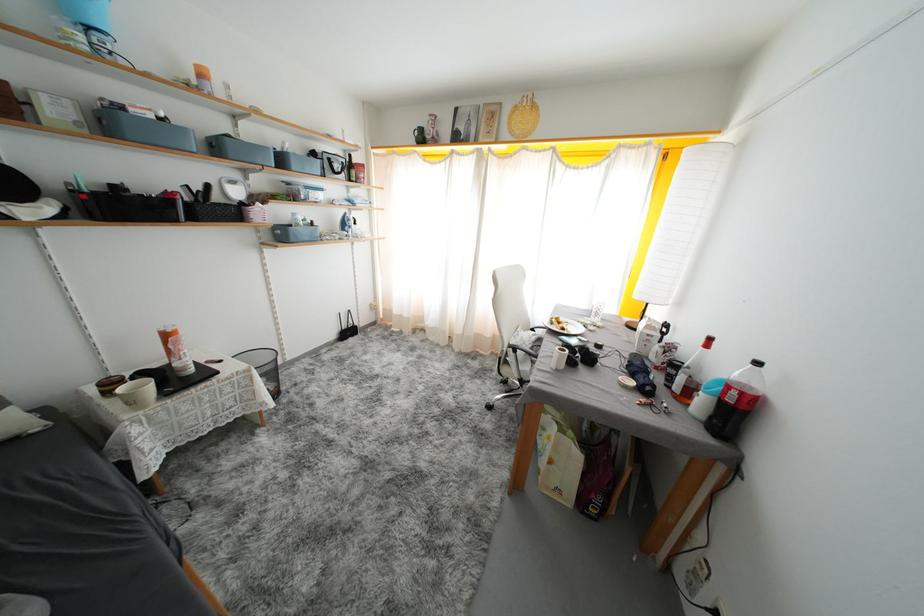
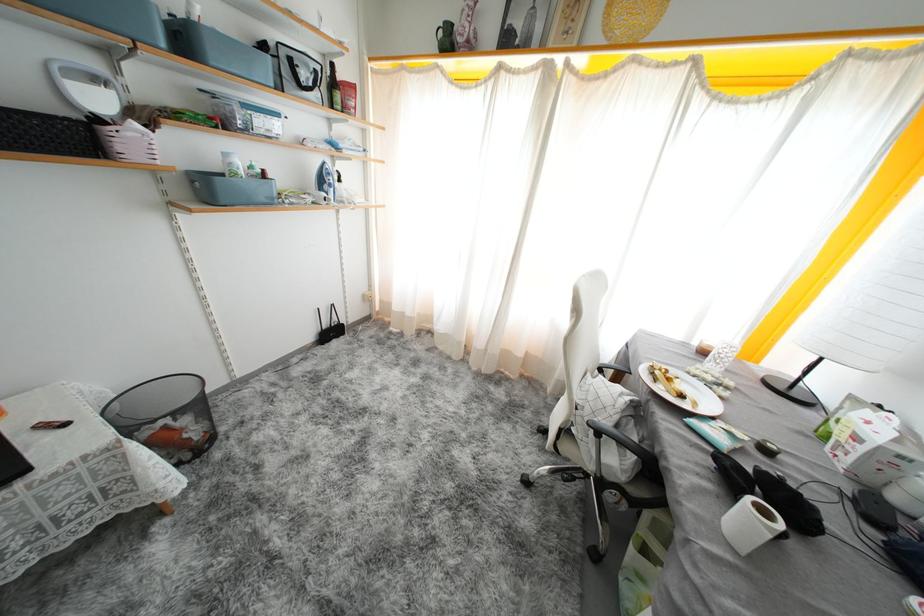
Where in the second image is the point corresponding to (239,185) from the first image?

(103, 84)